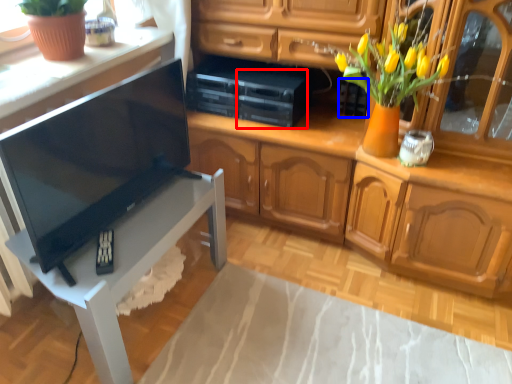
Question: Among these objects, which one is nearest to the camera, appliance (highlighted by a red box) or appliance (highlighted by a blue box)?

Choices:
 (A) appliance
 (B) appliance

Answer: (A)